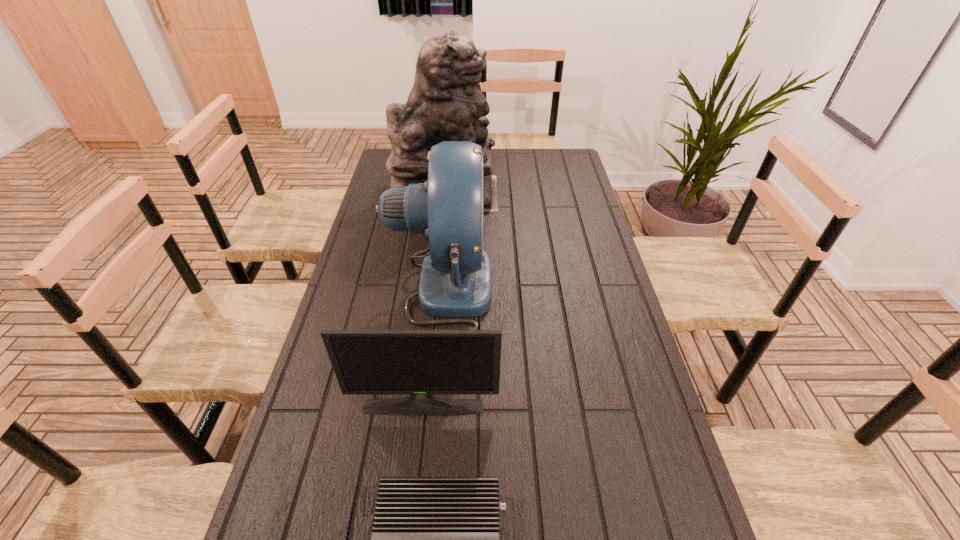
Identify the location of sculpture at the left edge. The width and height of the screenshot is (960, 540). (446, 103).

Locate an element on the screen. This screenshot has height=540, width=960. fan present at the left edge is located at coordinates (455, 281).

Find the location of a particular element. The height and width of the screenshot is (540, 960). monitor located in the left edge section of the desktop is located at coordinates (366, 362).

Identify the location of object located in the far left corner section of the desktop. The image size is (960, 540). (446, 103).

This screenshot has width=960, height=540. Identify the location of vacant area at the far edge. (531, 165).

Where is `free location at the left edge of the desktop`? This screenshot has height=540, width=960. free location at the left edge of the desktop is located at coordinates (375, 211).

Locate an element on the screen. free space at the right edge of the desktop is located at coordinates (555, 225).

Image resolution: width=960 pixels, height=540 pixels. In the image, there is a desktop. Identify the location of free space at the far left corner. (389, 156).

This screenshot has height=540, width=960. In the image, there is a desktop. Identify the location of vacant space at the far right corner. (552, 152).

At what (x,y) coordinates should I click in order to perform the action: click on the second closest object to the shortest object. Please return your answer as a coordinate pair (x, y). This screenshot has height=540, width=960. Looking at the image, I should click on (455, 281).